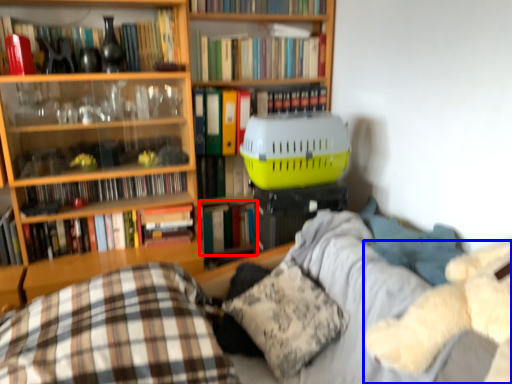
Question: Which point is further to the camera, book (highlighted by a red box) or teddy (highlighted by a blue box)?

Choices:
 (A) book
 (B) teddy

Answer: (A)